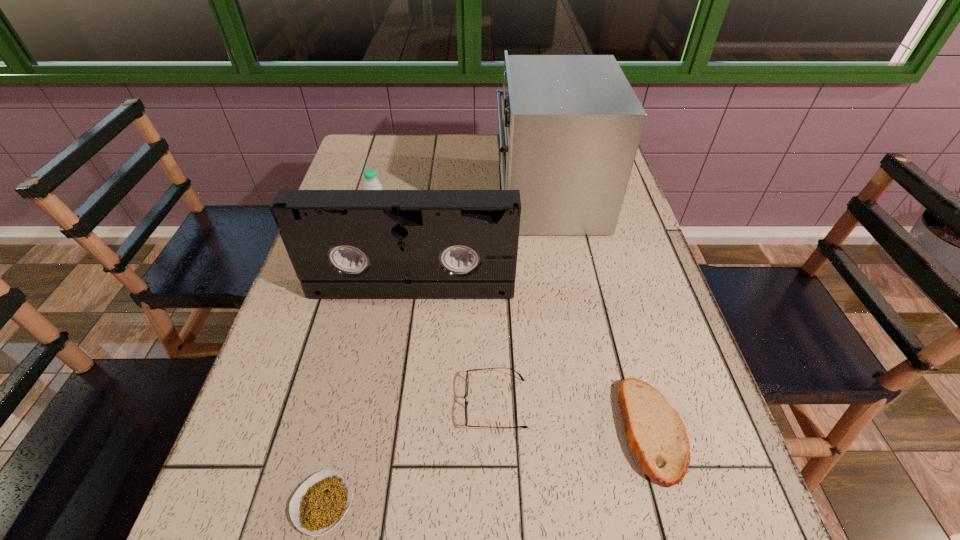
This screenshot has width=960, height=540. Find the location of `object that is the fourth closest one to the pita bread`. object that is the fourth closest one to the pita bread is located at coordinates (321, 502).

Find the location of a particular element. free space that satisfies the following two spatial constraints: 1. on the front panel of the pita bread; 2. on the left side of the toaster oven is located at coordinates (589, 429).

This screenshot has height=540, width=960. I want to click on free location that satisfies the following two spatial constraints: 1. on the front panel of the toaster oven; 2. on the front side of the legume, so click(603, 504).

Identify the location of vacant area in the image that satisfies the following two spatial constraints: 1. on the front panel of the tallest object; 2. on the back side of the pita bread. (589, 429).

This screenshot has height=540, width=960. What are the coordinates of `vacant space that satisfies the following two spatial constraints: 1. on the front panel of the tallest object; 2. on the front side of the water bottle` in the screenshot? It's located at (553, 223).